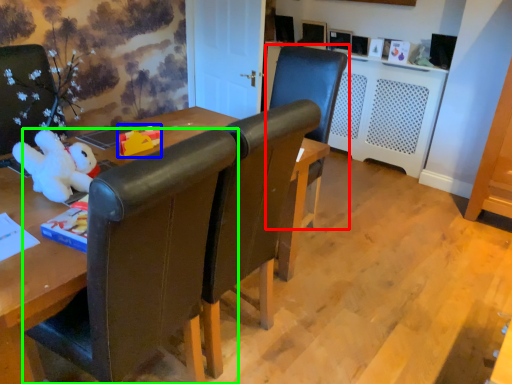
Question: Estimate the real-world distances between objects in this image. Which object is farther from chair (highlighted by a red box), toy (highlighted by a blue box) or chair (highlighted by a green box)?

Choices:
 (A) toy
 (B) chair

Answer: (B)